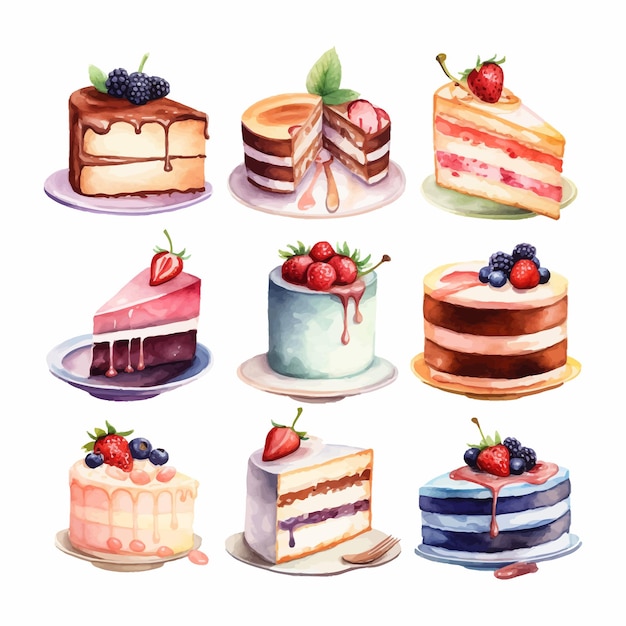
Locate an element on the screen. plates is located at coordinates (125, 565), (317, 565), (568, 548), (519, 390), (336, 390), (62, 367), (120, 208), (367, 198), (449, 201).